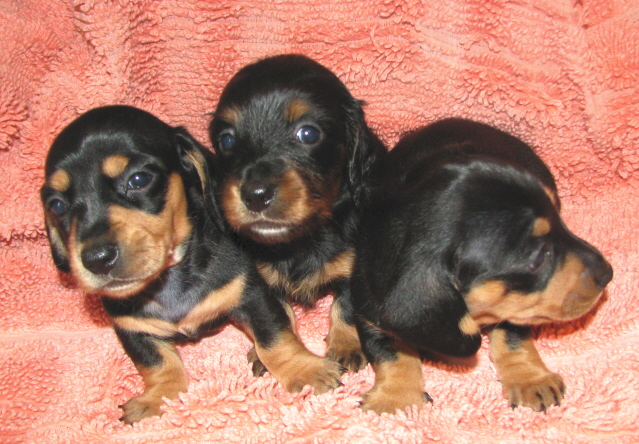
Locate an element on the screen. Image resolution: width=639 pixels, height=444 pixels. pink rug is located at coordinates (606, 389), (312, 322), (213, 361), (399, 68), (52, 310).